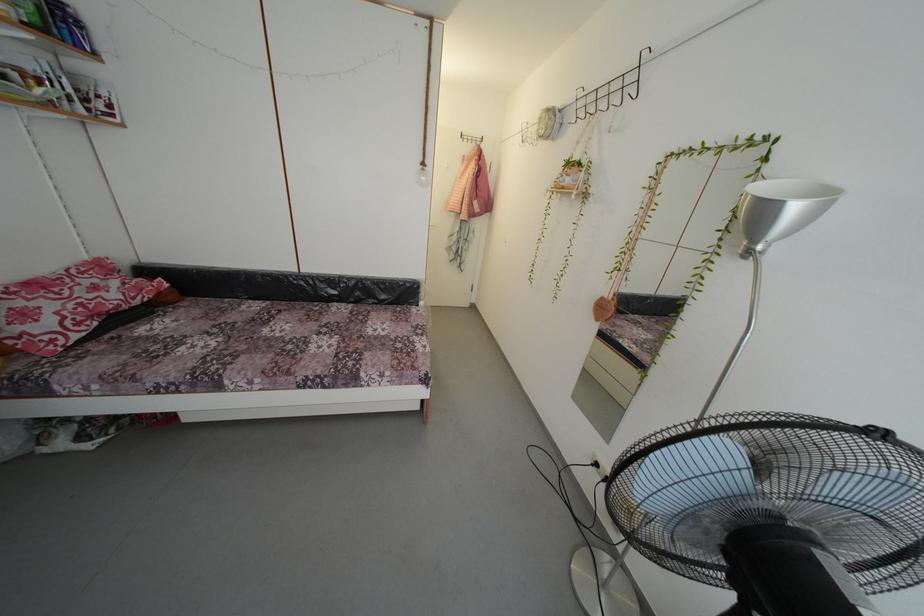
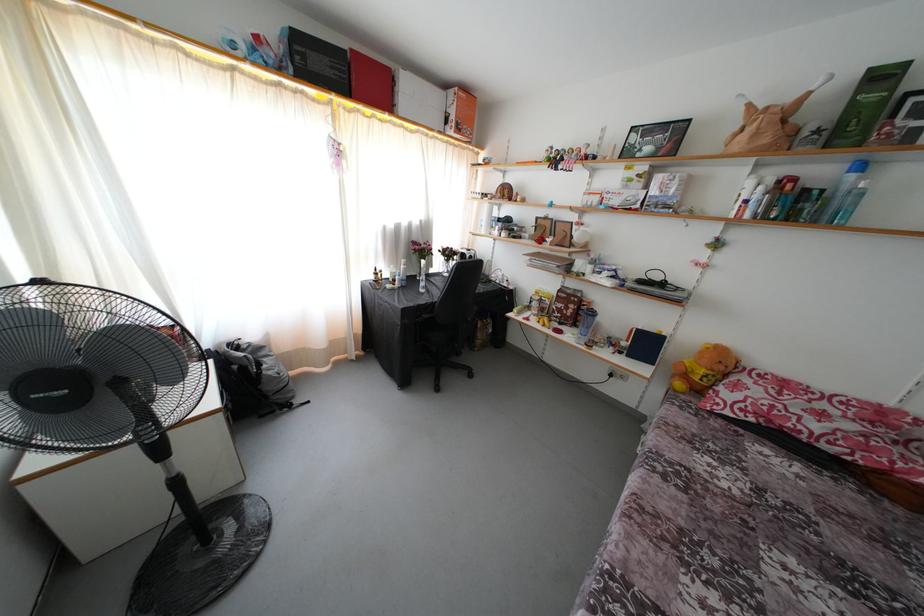
Find the pixel in the second image that matches [34,306] in the first image.

(760, 389)